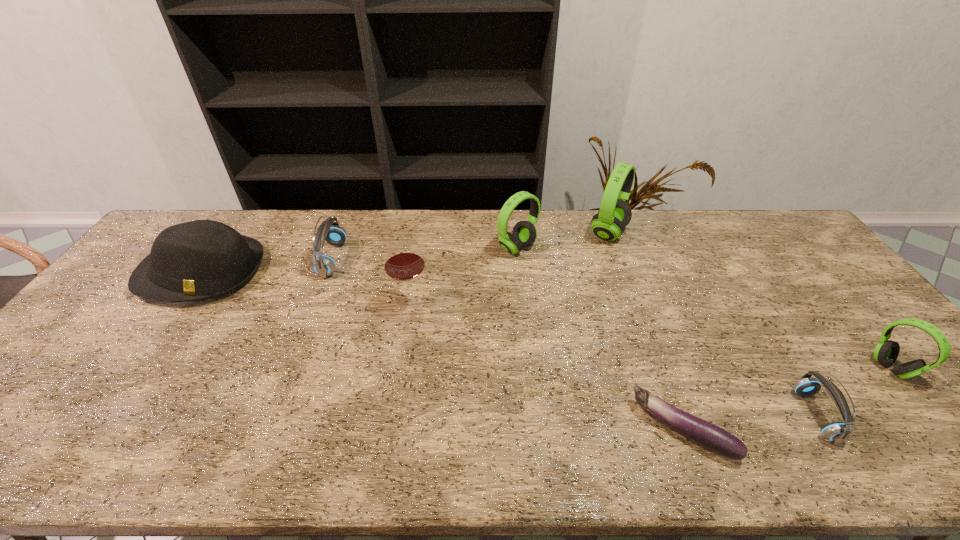
At what (x,y) coordinates should I click in order to perform the action: click on the tallest object. Please return your answer as a coordinate pair (x, y). Looking at the image, I should click on click(614, 214).

At what (x,y) coordinates should I click in order to perform the action: click on the biggest green headset. Please return your answer as a coordinate pair (x, y). Image resolution: width=960 pixels, height=540 pixels. Looking at the image, I should click on (614, 214).

Locate an element on the screen. The width and height of the screenshot is (960, 540). the second headset from left to right is located at coordinates (524, 234).

Where is `the fourth object from left to right`? This screenshot has height=540, width=960. the fourth object from left to right is located at coordinates (524, 234).

The height and width of the screenshot is (540, 960). Identify the location of the sixth object from right to left. (403, 261).

Locate an element on the screen. red wineglass is located at coordinates tap(403, 261).

The height and width of the screenshot is (540, 960). In order to click on the leftmost object in this screenshot , I will do `click(198, 260)`.

The width and height of the screenshot is (960, 540). I want to click on fedora, so click(198, 260).

Find the location of `the rightmost headset`. the rightmost headset is located at coordinates (886, 352).

Identify the location of the nearest green headset. The width and height of the screenshot is (960, 540). (886, 352).